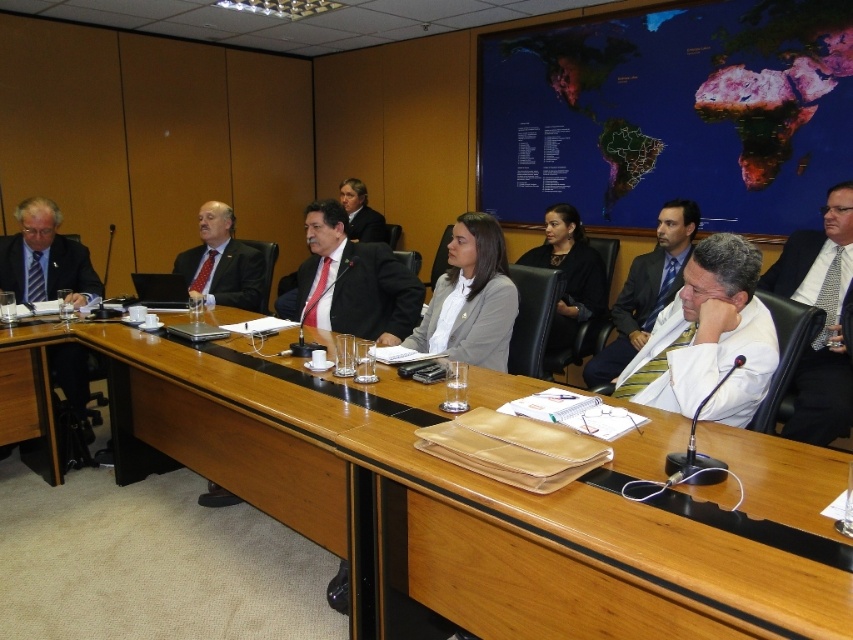
You are a guest attending a meeting and need to place your laptop on the wooden table at center. However, you notice the matte black suit at center is already occupying space on the table. Can you place your laptop there without moving the suit?

The wooden table at center is below matte black suit at center, meaning the suit is on top of the table. Since the suit is occupying space on the table, you would need to move it to place your laptop there.

You are a caterer setting up a dessert table for the meeting. The dessert table will be placed between the matte black suit at left and the black fabric jacket at center. If the dessert table requires 9 feet of space, will there be enough room?

The distance between the matte black suit at left and the black fabric jacket at center is 8.38 feet, which is less than the required 9 feet. Therefore, there will not be enough room for the dessert table.

You are organizing a photo shoot for a company brochure and need to ensure that the white lab coat at center and the white shirt at right are visible in the frame. Based on their widths, which one might require more careful framing to avoid being cut off?

The white lab coat at center has a lesser width compared to the white shirt at right, so the white shirt at right might require more careful framing to avoid being cut off since it is wider.